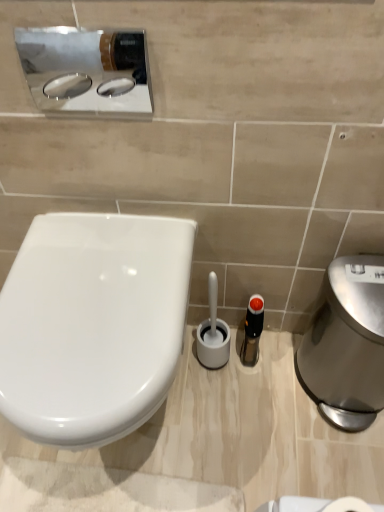
At what (x,y) coordinates should I click in order to perform the action: click on vacant space positioned to the left of polished stainless steel hand dryer at right. Please return your answer as a coordinate pair (x, y). This screenshot has width=384, height=512. Looking at the image, I should click on (256, 404).